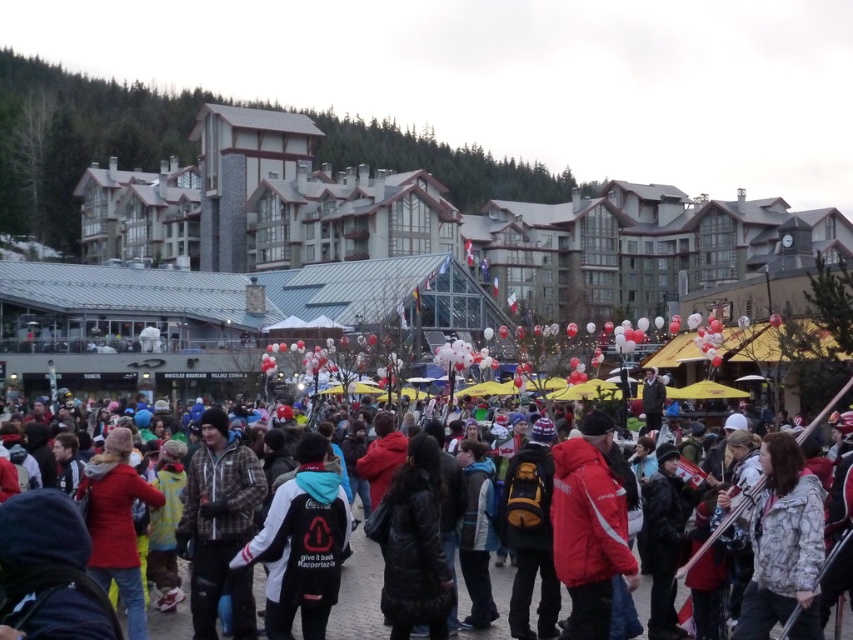
Question: Can you confirm if red matte jacket at center is positioned to the right of plaid fabric jacket at center?

Choices:
 (A) no
 (B) yes

Answer: (B)

Question: Which of the following is the closest to the observer?

Choices:
 (A) (300, 584)
 (B) (311, 180)

Answer: (A)

Question: Which point is farther to the camera?

Choices:
 (A) (764, 605)
 (B) (120, 333)
 (C) (225, 540)

Answer: (B)

Question: Can you confirm if wooden ski resort at center is wider than black fleece jacket at center?

Choices:
 (A) yes
 (B) no

Answer: (A)

Question: Is black fleece jacket at center positioned before white textured jacket at lower right?

Choices:
 (A) yes
 (B) no

Answer: (B)

Question: Based on their relative distances, which object is nearer to the white textured jacket at lower right?

Choices:
 (A) dark gray jacket at center
 (B) plaid fabric jacket at center
 (C) red matte jacket at center
 (D) black fleece jacket at center

Answer: (C)